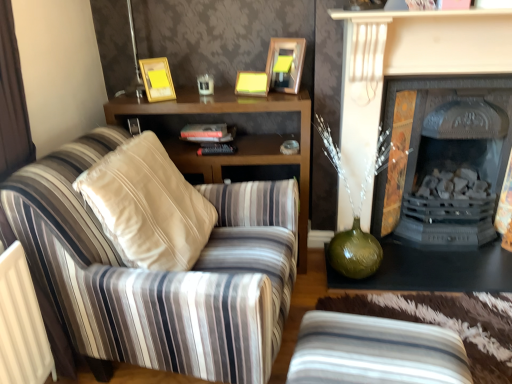
This screenshot has width=512, height=384. I want to click on free spot in front of matte gold picture frame at upper center, marked as the second picture frame in a left-to-right arrangement, so click(275, 99).